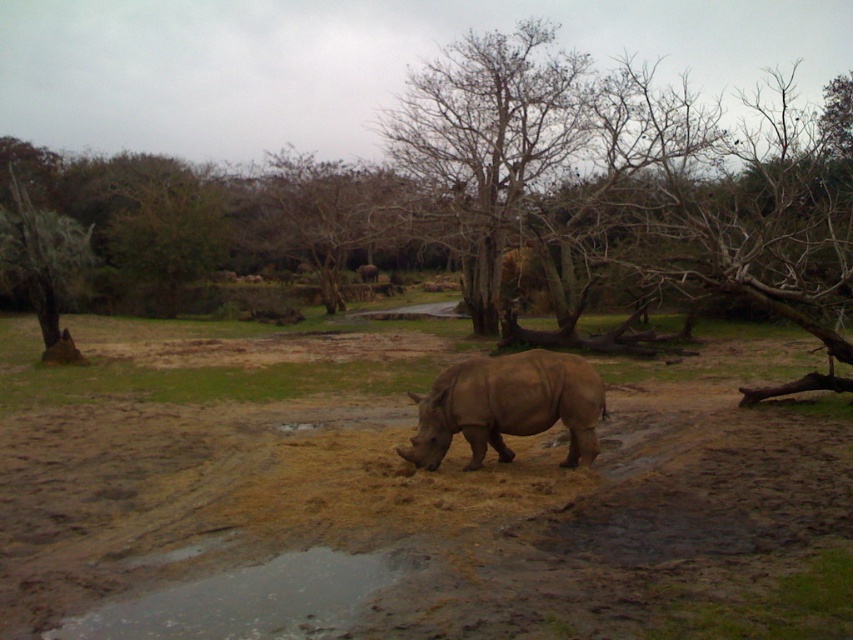
You are a wildlife photographer standing at the edge of the enclosure. You want to capture a closeup of the rhinoceros but need to stay at least 10 feet away for safety. Is the brown sandy dirt at center within your safe distance?

The brown sandy dirt at center is 12.14 feet away from camera, which is within the safe distance of 10 feet. However, since the photographer must stay at least 10 feet away, they can safely position themselves at the brown sandy dirt at center as it meets the minimum distance requirement.

You are a park ranger trying to track the rhinoceros. You notice the brown sandy dirt at center and the reflective wet mud at lower center. Which surface would show clearer footprints for tracking?

The brown sandy dirt at center would show clearer footprints because it is in front of the reflective wet mud at lower center, meaning it is a drier surface where tracks are more defined.

You are a small animal trying to cross from the brown sandy dirt at center to the bare wood tree at center. Which object is lower in height and would be easier to climb over?

The brown sandy dirt at center has a lesser height compared to the bare wood tree at center, so it would be easier to climb over the brown sandy dirt at center.